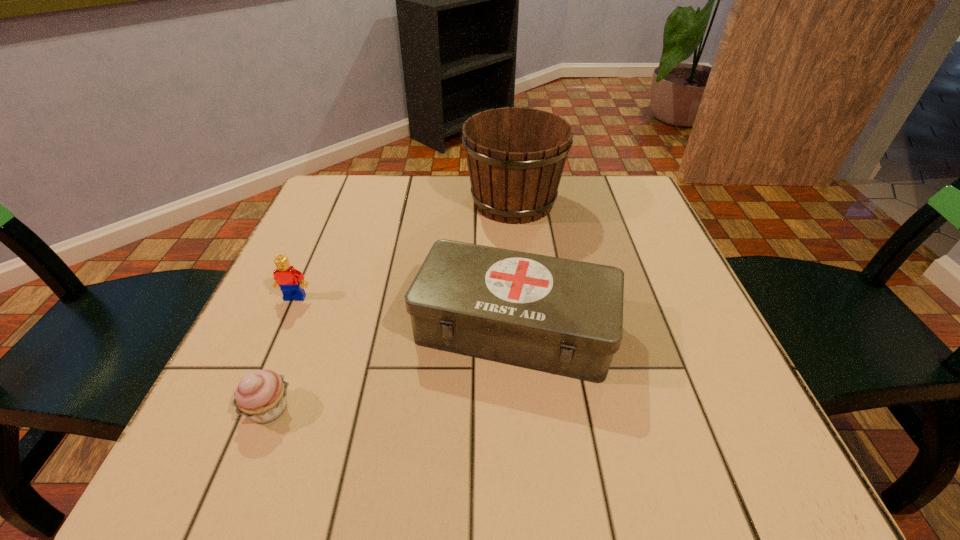
The image size is (960, 540). I want to click on object identified as the third closest to the first-aid kit, so click(x=287, y=278).

Locate which object is the third closest to the wine bucket. Please provide its 2D coordinates. Your answer should be formatted as a tuple, i.e. [(x, y)], where the tuple contains the x and y coordinates of a point satisfying the conditions above.

[(261, 396)]

You are a GUI agent. You are given a task and a screenshot of the screen. Output one action in this format:
    pyautogui.click(x=<x>, y=<y>)
    Task: Click on the vacant area that satisfies the following two spatial constraints: 1. on the back side of the shortest object; 2. on the left side of the first-aid kit
    This screenshot has width=960, height=540.
    Given the screenshot: What is the action you would take?
    pyautogui.click(x=301, y=327)

Where is `vacant region that satisfies the following two spatial constraints: 1. on the front-facing side of the first-aid kit; 2. on the right side of the Lego`? vacant region that satisfies the following two spatial constraints: 1. on the front-facing side of the first-aid kit; 2. on the right side of the Lego is located at coordinates (282, 327).

The width and height of the screenshot is (960, 540). Find the location of `free location that satisfies the following two spatial constraints: 1. on the front-facing side of the first-aid kit; 2. on the right side of the Lego`. free location that satisfies the following two spatial constraints: 1. on the front-facing side of the first-aid kit; 2. on the right side of the Lego is located at coordinates (282, 327).

This screenshot has height=540, width=960. I want to click on vacant space that satisfies the following two spatial constraints: 1. on the front-facing side of the Lego; 2. on the left side of the first-aid kit, so click(x=282, y=327).

Identify the location of vacant point that satisfies the following two spatial constraints: 1. on the front-facing side of the Lego; 2. on the left side of the shortest object. Image resolution: width=960 pixels, height=540 pixels. (247, 408).